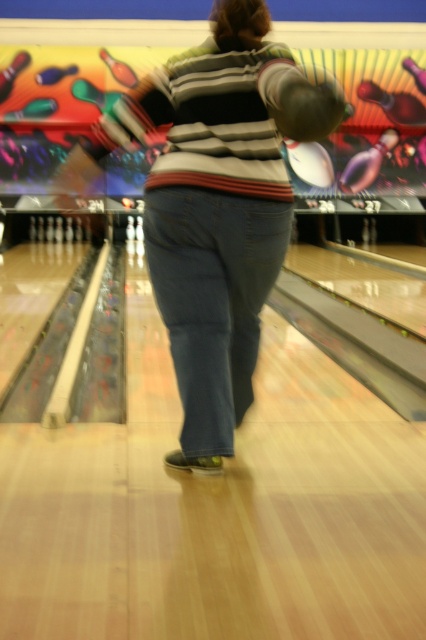
Is striped sweater at center to the right of denim at center from the viewer's perspective?

Correct, you'll find striped sweater at center to the right of denim at center.

Is striped sweater at center further to the viewer compared to denim at center?

No.

Is point (226, 218) farther from viewer compared to point (213, 413)?

No, (226, 218) is in front of (213, 413).

Where is `striped sweater at center`? striped sweater at center is located at coordinates (219, 208).